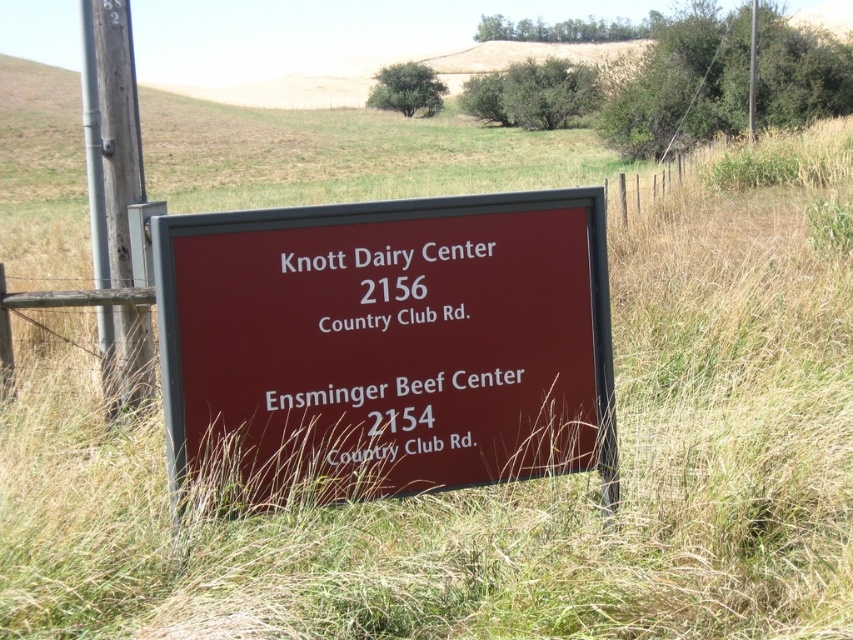
You are a delivery driver who needs to deliver a package to the Knott Dairy Center. You see the maroon plastic sign at center and the maroon sign at center in the distance. Which sign should you follow for directions to Knott Dairy Center?

You should follow the maroon plastic sign at center because it is much taller than the maroon sign at center, making it more visible and likely the correct one for directions.